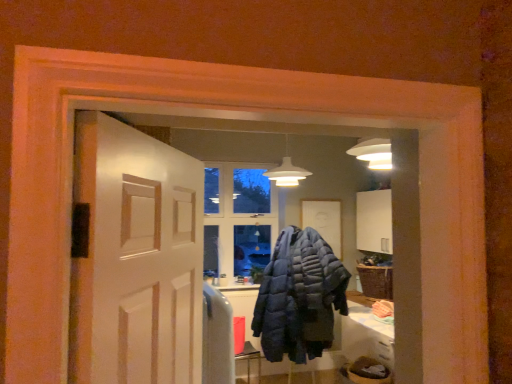
Question: Should I look upward or downward to see dark blue quilted jacket at center?

Choices:
 (A) up
 (B) down

Answer: (B)

Question: Considering the relative sizes of dark blue quilted jacket at center and white glossy door at center in the image provided, is dark blue quilted jacket at center bigger than white glossy door at center?

Choices:
 (A) no
 (B) yes

Answer: (B)

Question: Does dark blue quilted jacket at center turn towards white glossy door at center?

Choices:
 (A) no
 (B) yes

Answer: (A)

Question: Considering the relative positions of dark blue quilted jacket at center and white glossy door at center in the image provided, is dark blue quilted jacket at center to the left of white glossy door at center from the viewer's perspective?

Choices:
 (A) yes
 (B) no

Answer: (B)

Question: Is dark blue quilted jacket at center not close to white glossy door at center?

Choices:
 (A) no
 (B) yes

Answer: (B)

Question: Considering the relative positions of dark blue quilted jacket at center and white glossy door at center in the image provided, is dark blue quilted jacket at center in front of white glossy door at center?

Choices:
 (A) no
 (B) yes

Answer: (A)

Question: Is dark blue quilted jacket at center further to camera compared to white glossy door at center?

Choices:
 (A) no
 (B) yes

Answer: (B)

Question: Can you confirm if white glossy door at center is bigger than dark blue quilted jacket at center?

Choices:
 (A) no
 (B) yes

Answer: (A)

Question: Does white glossy door at center appear on the left side of dark blue quilted jacket at center?

Choices:
 (A) no
 (B) yes

Answer: (B)

Question: Does white glossy door at center touch dark blue quilted jacket at center?

Choices:
 (A) no
 (B) yes

Answer: (A)

Question: From a real-world perspective, is white glossy door at center physically above dark blue quilted jacket at center?

Choices:
 (A) no
 (B) yes

Answer: (B)

Question: Is white glossy door at center looking in the opposite direction of dark blue quilted jacket at center?

Choices:
 (A) no
 (B) yes

Answer: (A)

Question: Is white glossy door at center positioned before dark blue quilted jacket at center?

Choices:
 (A) yes
 (B) no

Answer: (A)

Question: Considering the positions of dark blue quilted jacket at center and white glossy door at center in the image, is dark blue quilted jacket at center taller or shorter than white glossy door at center?

Choices:
 (A) short
 (B) tall

Answer: (B)